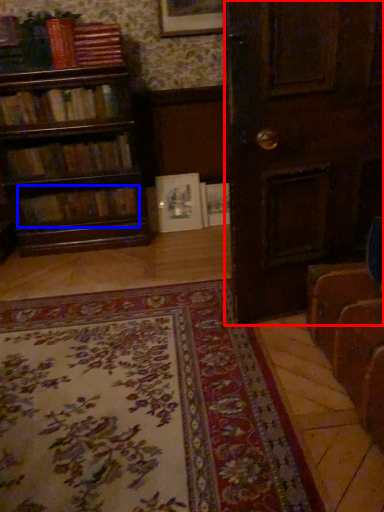
Question: Which point is further to the camera, door (highlighted by a red box) or book (highlighted by a blue box)?

Choices:
 (A) door
 (B) book

Answer: (B)